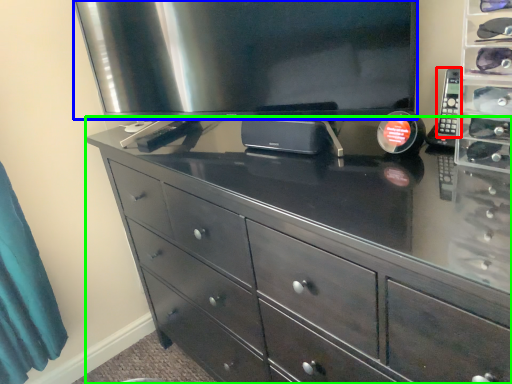
Question: Which object is positioned closest to control (highlighted by a red box)? Select from television (highlighted by a blue box) and chest of drawers (highlighted by a green box).

Choices:
 (A) television
 (B) chest of drawers

Answer: (A)